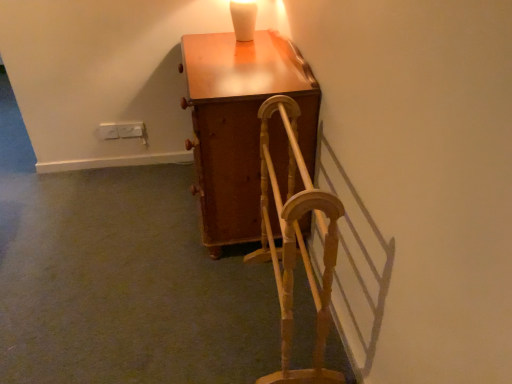
Where is `wooden textured rocking chair at center`? The width and height of the screenshot is (512, 384). wooden textured rocking chair at center is located at coordinates (296, 243).

What do you see at coordinates (296, 243) in the screenshot? Image resolution: width=512 pixels, height=384 pixels. I see `wooden textured rocking chair at center` at bounding box center [296, 243].

Image resolution: width=512 pixels, height=384 pixels. What are the coordinates of `wooden cabinet at center` in the screenshot? It's located at (240, 124).

The height and width of the screenshot is (384, 512). What do you see at coordinates (240, 124) in the screenshot? I see `wooden cabinet at center` at bounding box center [240, 124].

I want to click on wooden textured rocking chair at center, so click(x=296, y=243).

Consider the image. Based on their positions, is wooden textured rocking chair at center located to the left or right of wooden cabinet at center?

wooden textured rocking chair at center is positioned on wooden cabinet at center's right side.

Is wooden textured rocking chair at center further to the viewer compared to wooden cabinet at center?

No, it is in front of wooden cabinet at center.

Which point is more forward, (340,212) or (201,140)?

Positioned in front is point (340,212).

From the image's perspective, which object appears higher, wooden textured rocking chair at center or wooden cabinet at center?

From the image's view, wooden cabinet at center is above.

From a real-world perspective, is wooden textured rocking chair at center physically located above or below wooden cabinet at center?

Clearly, from a real-world perspective, wooden textured rocking chair at center is below wooden cabinet at center.

Is wooden textured rocking chair at center wider than wooden cabinet at center?

In fact, wooden textured rocking chair at center might be narrower than wooden cabinet at center.

Does wooden textured rocking chair at center have a greater height compared to wooden cabinet at center?

In fact, wooden textured rocking chair at center may be shorter than wooden cabinet at center.

Can you confirm if wooden textured rocking chair at center is smaller than wooden cabinet at center?

Correct, wooden textured rocking chair at center occupies less space than wooden cabinet at center.

Could wooden cabinet at center be considered to be inside wooden textured rocking chair at center?

Definitely not — wooden cabinet at center is not inside wooden textured rocking chair at center.

Is wooden textured rocking chair at center with wooden cabinet at center?

No, wooden textured rocking chair at center is not making contact with wooden cabinet at center.

Does wooden textured rocking chair at center turn towards wooden cabinet at center?

No, wooden textured rocking chair at center does not turn towards wooden cabinet at center.

Where is `rocking chair that appears on the right of wooden cabinet at center`? This screenshot has height=384, width=512. rocking chair that appears on the right of wooden cabinet at center is located at coordinates (296, 243).

Is wooden cabinet at center at the left side of wooden textured rocking chair at center?

Yes.

Is wooden cabinet at center closer to the viewer compared to wooden textured rocking chair at center?

No, the depth of wooden cabinet at center is greater than that of wooden textured rocking chair at center.

Is point (227, 84) positioned before point (271, 109)?

No, (227, 84) is behind (271, 109).

From the image's perspective, which one is positioned higher, wooden cabinet at center or wooden textured rocking chair at center?

wooden cabinet at center.

From a real-world perspective, between wooden cabinet at center and wooden textured rocking chair at center, who is vertically higher?

wooden cabinet at center, from a real-world perspective.

Considering the sizes of objects wooden cabinet at center and wooden textured rocking chair at center in the image provided, who is thinner, wooden cabinet at center or wooden textured rocking chair at center?

wooden textured rocking chair at center.

Between wooden cabinet at center and wooden textured rocking chair at center, which one has less height?

wooden textured rocking chair at center is shorter.

Which of these two, wooden cabinet at center or wooden textured rocking chair at center, is bigger?

Bigger between the two is wooden cabinet at center.

Does wooden cabinet at center contain wooden textured rocking chair at center?

No, wooden textured rocking chair at center is not a part of wooden cabinet at center.

Is wooden cabinet at center beside wooden textured rocking chair at center?

No, wooden cabinet at center is not next to wooden textured rocking chair at center.

Is wooden cabinet at center looking in the opposite direction of wooden textured rocking chair at center?

wooden cabinet at center is not turned away from wooden textured rocking chair at center.

What's the angular difference between wooden cabinet at center and wooden textured rocking chair at center's facing directions?

The angle between the facing direction of wooden cabinet at center and the facing direction of wooden textured rocking chair at center is 5.45 degrees.

Locate an element on the screen. The width and height of the screenshot is (512, 384). furniture lying above the wooden textured rocking chair at center (from the image's perspective) is located at coordinates (240, 124).

Find the location of a particular element. This screenshot has height=384, width=512. rocking chair below the wooden cabinet at center (from the image's perspective) is located at coordinates tap(296, 243).

At what (x,y) coordinates should I click in order to perform the action: click on rocking chair below the wooden cabinet at center (from a real-world perspective). Please return your answer as a coordinate pair (x, y). Looking at the image, I should click on (296, 243).